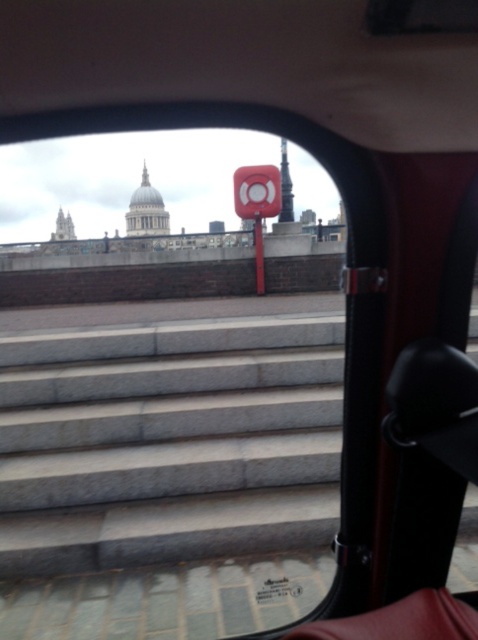
Question: Which point is farther to the camera?

Choices:
 (A) black plastic rearview mirror at upper right
 (B) gray concrete stairs at center

Answer: (B)

Question: Does gray concrete stairs at center lie behind black plastic rearview mirror at upper right?

Choices:
 (A) yes
 (B) no

Answer: (A)

Question: Is gray concrete stairs at center bigger than black plastic rearview mirror at upper right?

Choices:
 (A) yes
 (B) no

Answer: (A)

Question: Is gray concrete stairs at center positioned before black plastic rearview mirror at upper right?

Choices:
 (A) yes
 (B) no

Answer: (B)